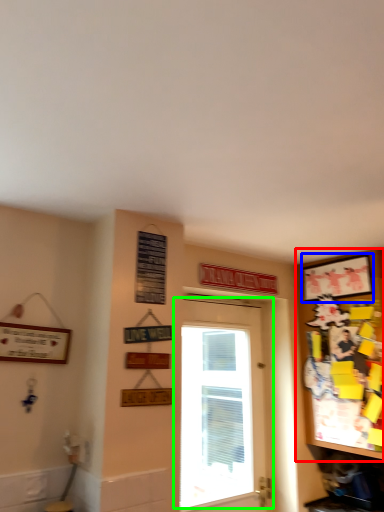
Question: Estimate the real-world distances between objects in this image. Which object is farther from cabinetry (highlighted by a red box), picture frame (highlighted by a blue box) or door (highlighted by a green box)?

Choices:
 (A) picture frame
 (B) door

Answer: (B)